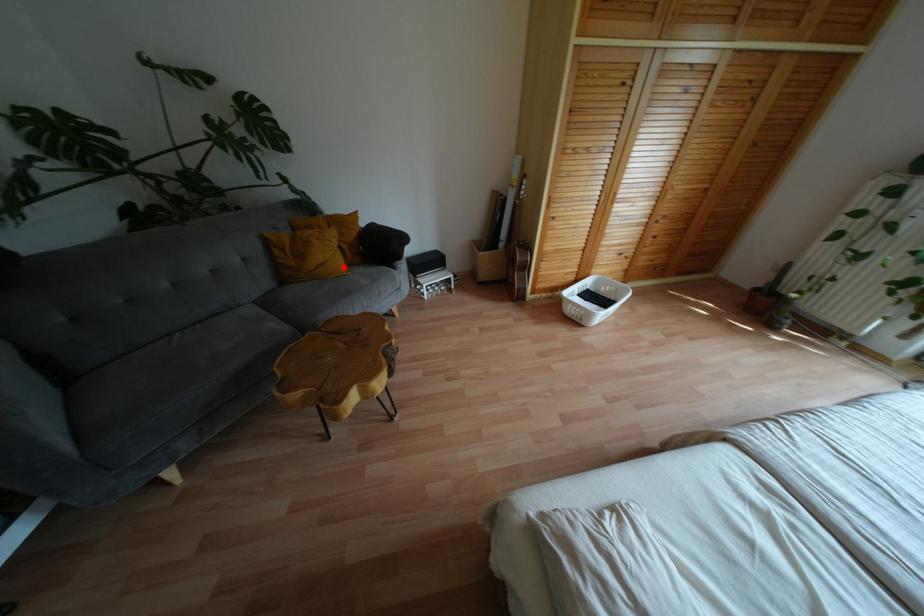
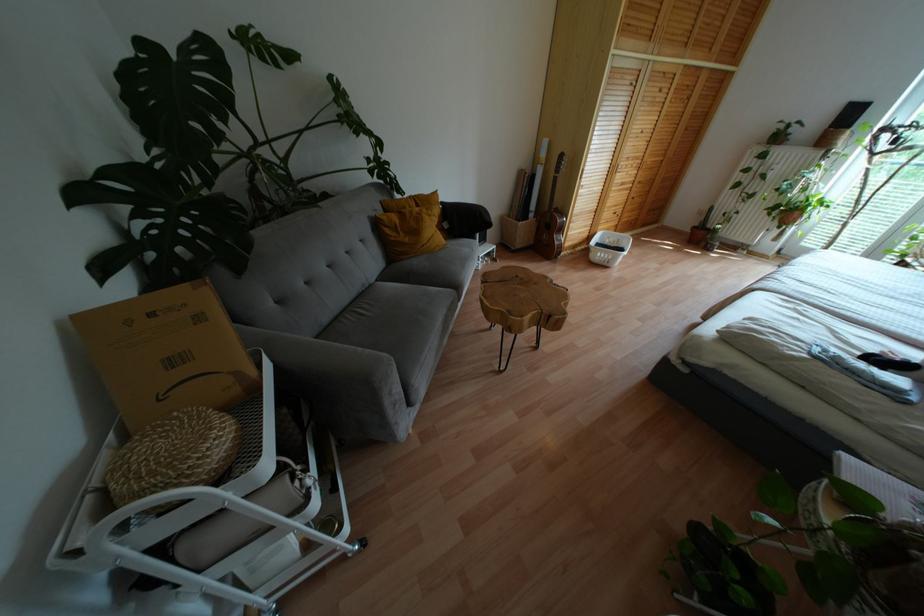
Find the pixel in the second image that matches the highlighted location in the first image.

(443, 240)